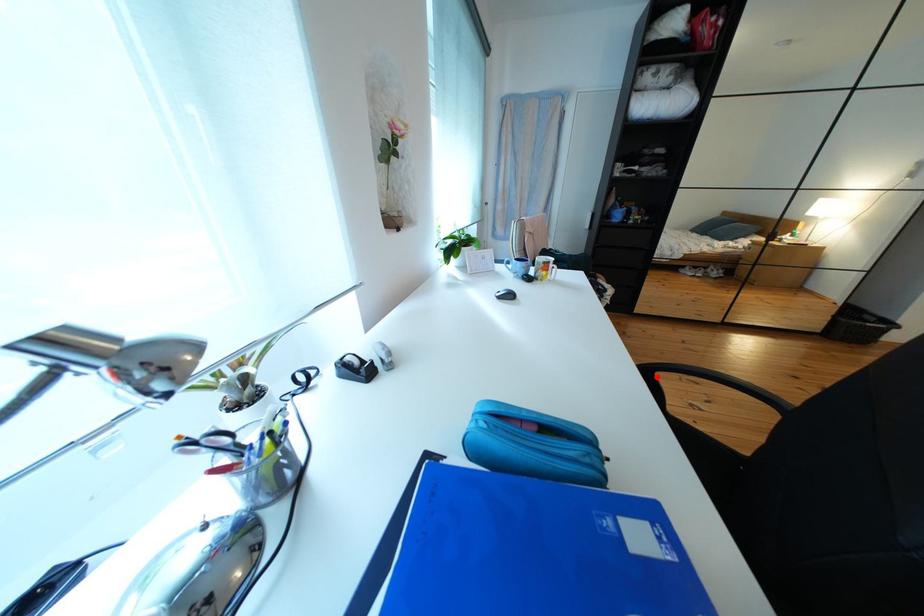
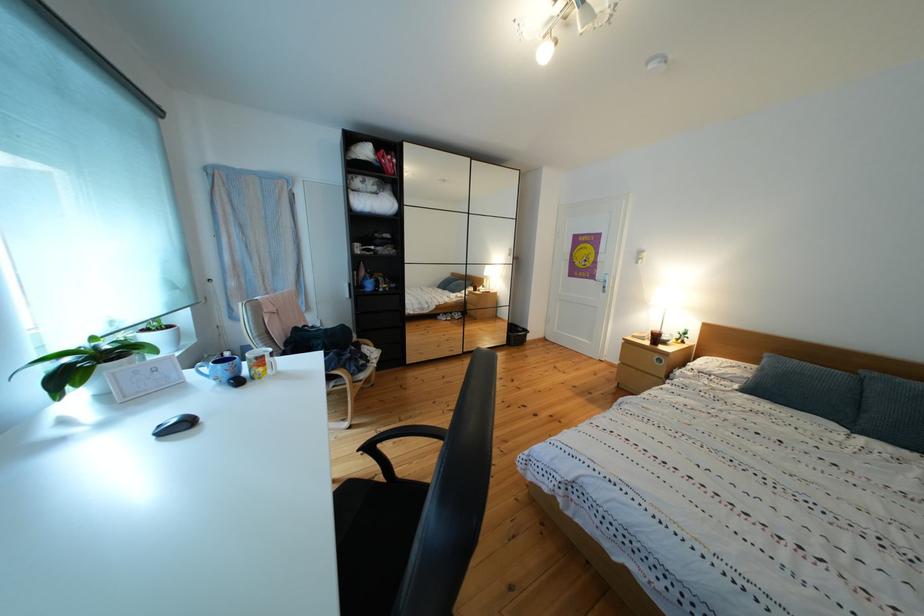
Find the pixel in the second image that matches the highlighted location in the first image.

(382, 454)